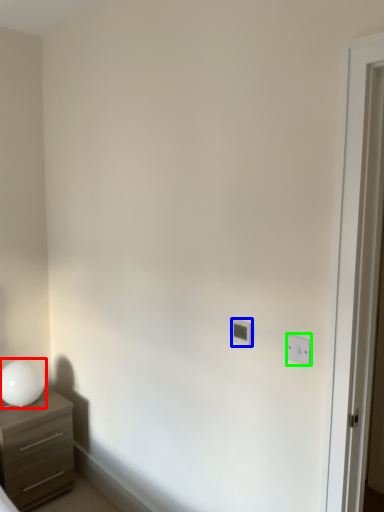
Question: Considering the real-world distances, which object is closest to table lamp (highlighted by a red box)? light switch (highlighted by a blue box) or light switch (highlighted by a green box).

Choices:
 (A) light switch
 (B) light switch

Answer: (A)